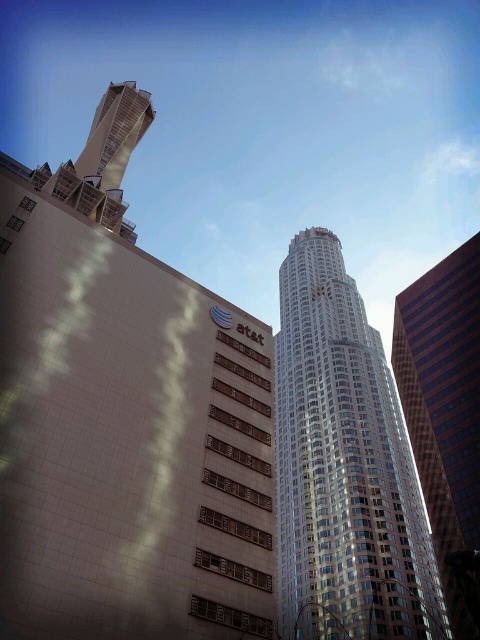
Question: Can you confirm if silver glass skyscraper at center is bigger than glassy reflective skyscraper at right?

Choices:
 (A) no
 (B) yes

Answer: (B)

Question: Can you confirm if silver glass skyscraper at center is bigger than glassy reflective skyscraper at right?

Choices:
 (A) no
 (B) yes

Answer: (B)

Question: Which object appears closest to the camera in this image?

Choices:
 (A) silver glass skyscraper at center
 (B) glassy reflective skyscraper at right

Answer: (A)

Question: Among these objects, which one is farthest from the camera?

Choices:
 (A) glassy reflective skyscraper at right
 (B) silver glass skyscraper at center

Answer: (A)

Question: Among these objects, which one is nearest to the camera?

Choices:
 (A) silver glass skyscraper at center
 (B) glassy reflective skyscraper at right

Answer: (A)

Question: Is silver glass skyscraper at center above glassy reflective skyscraper at right?

Choices:
 (A) yes
 (B) no

Answer: (A)